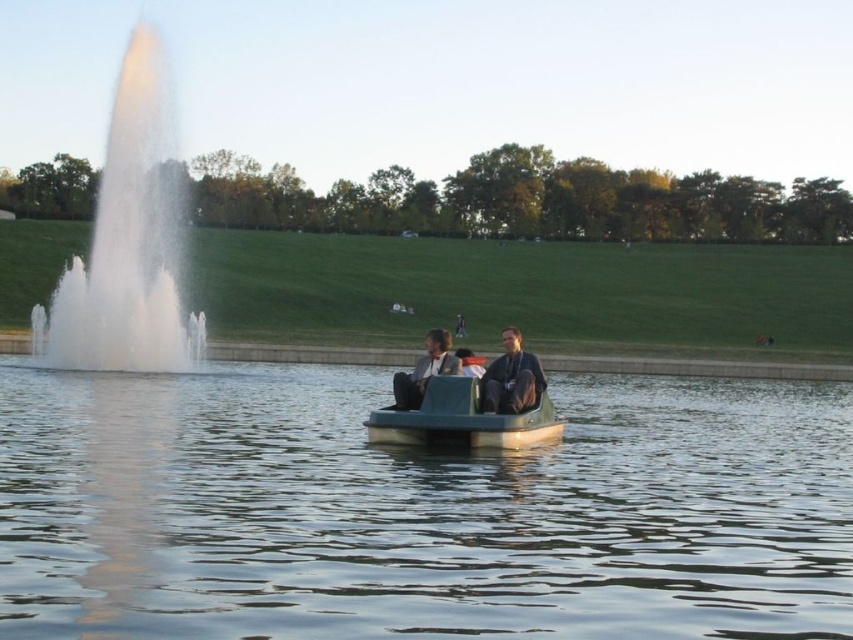
Is white frothy water at left to the left of matte gray jacket at center from the viewer's perspective?

Indeed, white frothy water at left is positioned on the left side of matte gray jacket at center.

Which of these two, white frothy water at left or matte gray jacket at center, stands taller?

white frothy water at left

The width and height of the screenshot is (853, 640). Describe the element at coordinates (131, 241) in the screenshot. I see `white frothy water at left` at that location.

Identify the location of white frothy water at left. The width and height of the screenshot is (853, 640). (131, 241).

Is green smooth water at center closer to camera compared to dark gray fabric jacket at center?

Yes, it is.

Who is more distant from viewer, (492, 557) or (486, 369)?

Positioned behind is point (486, 369).

Describe the element at coordinates (418, 509) in the screenshot. I see `green smooth water at center` at that location.

Locate an element on the screen. green smooth water at center is located at coordinates (418, 509).

Does green matte boat at center have a greater height compared to matte black boat at center?

Incorrect, green matte boat at center's height is not larger of matte black boat at center's.

Between point (486, 429) and point (454, 369), which one is positioned in front?

Point (486, 429)

In order to click on green matte boat at center in this screenshot , I will do click(x=463, y=419).